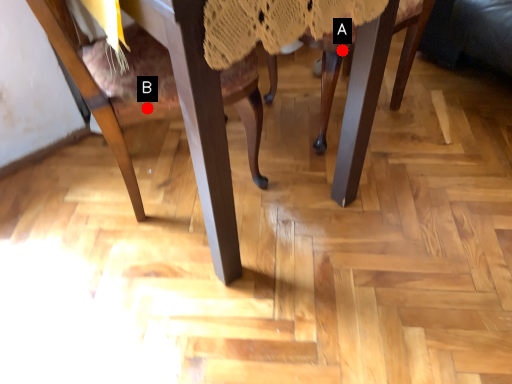
Question: Two points are circled on the image, labeled by A and B beside each circle. Which point is farther to the camera?

Choices:
 (A) A is further
 (B) B is further

Answer: (A)